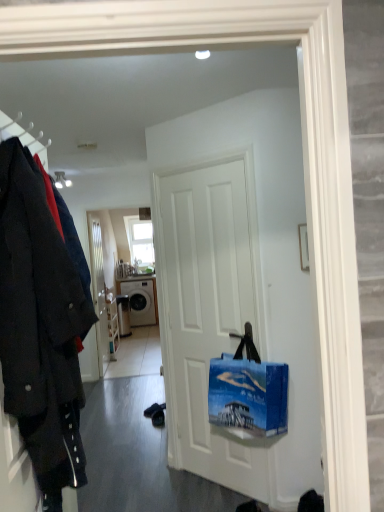
Find the location of a particular element. The image size is (384, 512). free spot in front of white matte door at center, the second door when ordered from left to right is located at coordinates (210, 500).